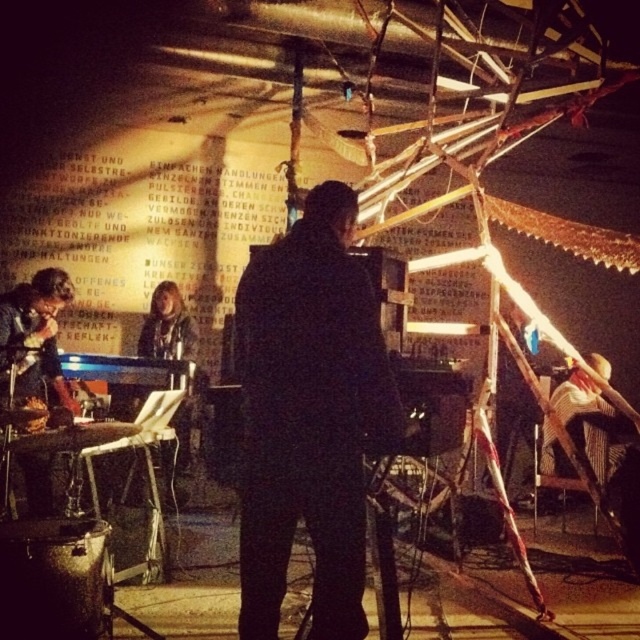
Question: Which object appears farthest from the camera in this image?

Choices:
 (A) black matte jacket at center
 (B) shiny black drum set at lower left

Answer: (B)

Question: Considering the relative positions of black matte jacket at center and shiny black drum set at lower left in the image provided, where is black matte jacket at center located with respect to shiny black drum set at lower left?

Choices:
 (A) left
 (B) right

Answer: (B)

Question: Is black matte jacket at center below shiny black drum set at lower left?

Choices:
 (A) no
 (B) yes

Answer: (A)

Question: Does black matte jacket at center appear on the right side of shiny black drum set at lower left?

Choices:
 (A) no
 (B) yes

Answer: (B)